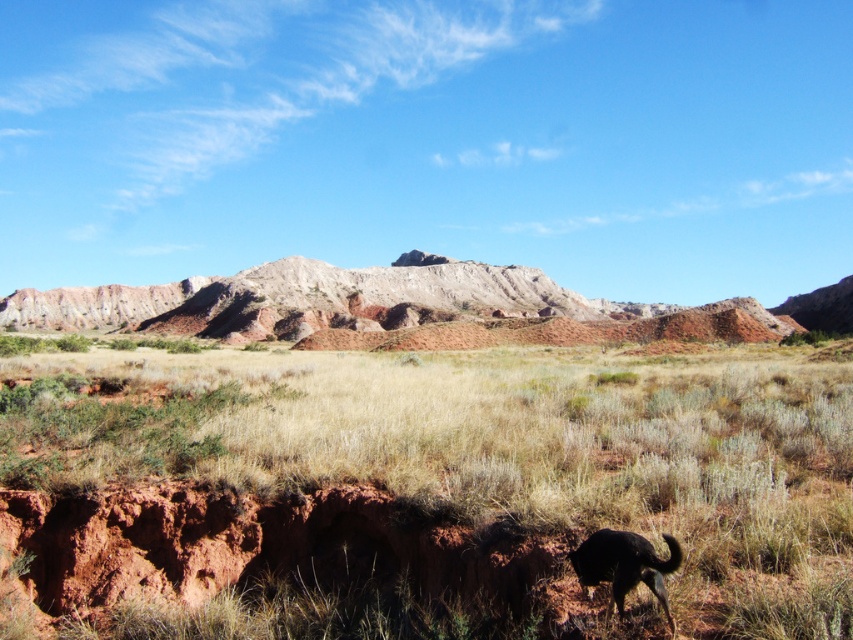
Which is below, brown dirt at center or black fur dog at lower right?

black fur dog at lower right

Which is behind, point (20, 456) or point (645, 538)?

The point (20, 456) is behind.

Find the location of a particular element. This screenshot has width=853, height=640. brown dirt at center is located at coordinates (421, 490).

Can you confirm if rustic sandstone mountain at center is wider than black fur dog at lower right?

Yes, rustic sandstone mountain at center is wider than black fur dog at lower right.

Is point (343, 268) positioned before point (614, 579)?

No.

Is point (189, 289) more distant than point (596, 534)?

Yes.

Locate an element on the screen. The image size is (853, 640). rustic sandstone mountain at center is located at coordinates (409, 308).

Is brown dirt at center taller than rustic sandstone mountain at center?

No, brown dirt at center is not taller than rustic sandstone mountain at center.

Can you confirm if brown dirt at center is positioned below rustic sandstone mountain at center?

Correct, brown dirt at center is located below rustic sandstone mountain at center.

Find the location of a particular element. This screenshot has height=640, width=853. brown dirt at center is located at coordinates (421, 490).

Where is `brown dirt at center`? brown dirt at center is located at coordinates (421, 490).